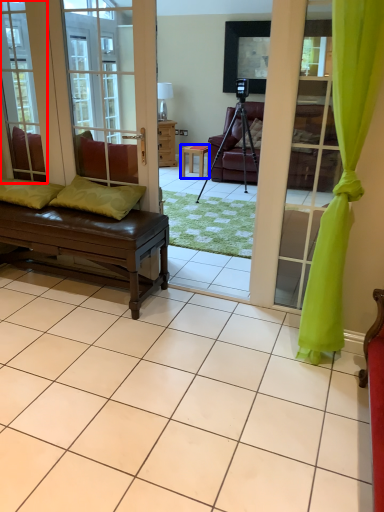
Question: Which of the following is the farthest to the observer, window (highlighted by a red box) or table (highlighted by a blue box)?

Choices:
 (A) window
 (B) table

Answer: (B)